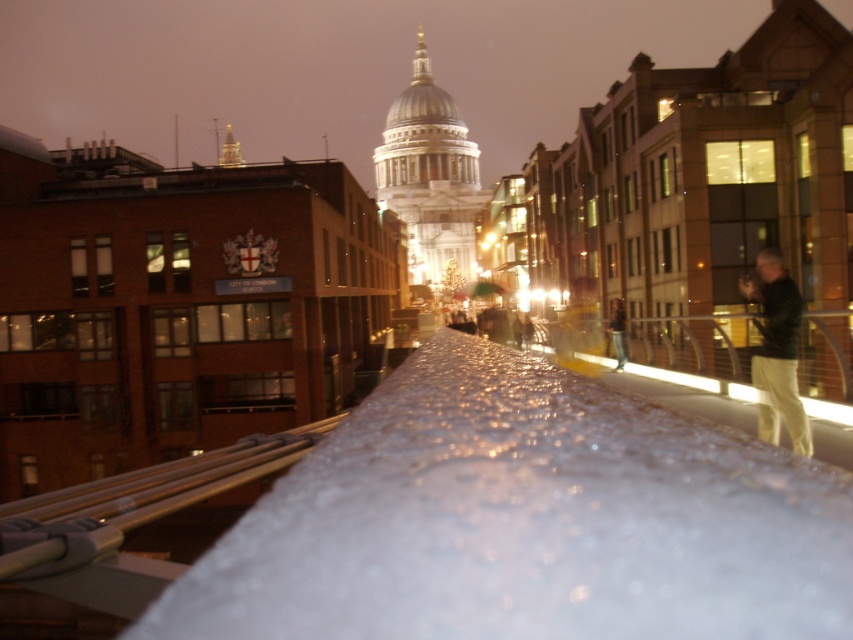
Question: Can you confirm if transparent frosted snow at center is bigger than light brown leather jacket at right?

Choices:
 (A) yes
 (B) no

Answer: (A)

Question: Which object is farther from the camera taking this photo?

Choices:
 (A) transparent frosted snow at center
 (B) dark green jacket at right
 (C) light brown leather jacket at right

Answer: (C)

Question: Which of these objects is positioned farthest from the transparent frosted snow at center?

Choices:
 (A) dark green jacket at right
 (B) light brown leather jacket at right

Answer: (B)

Question: Among these points, which one is nearest to the camera?

Choices:
 (A) (612, 342)
 (B) (521, 460)
 (C) (793, 353)

Answer: (B)

Question: Is transparent frosted snow at center smaller than dark green jacket at right?

Choices:
 (A) yes
 (B) no

Answer: (B)

Question: Can you confirm if transparent frosted snow at center is bigger than light brown leather jacket at right?

Choices:
 (A) no
 (B) yes

Answer: (B)